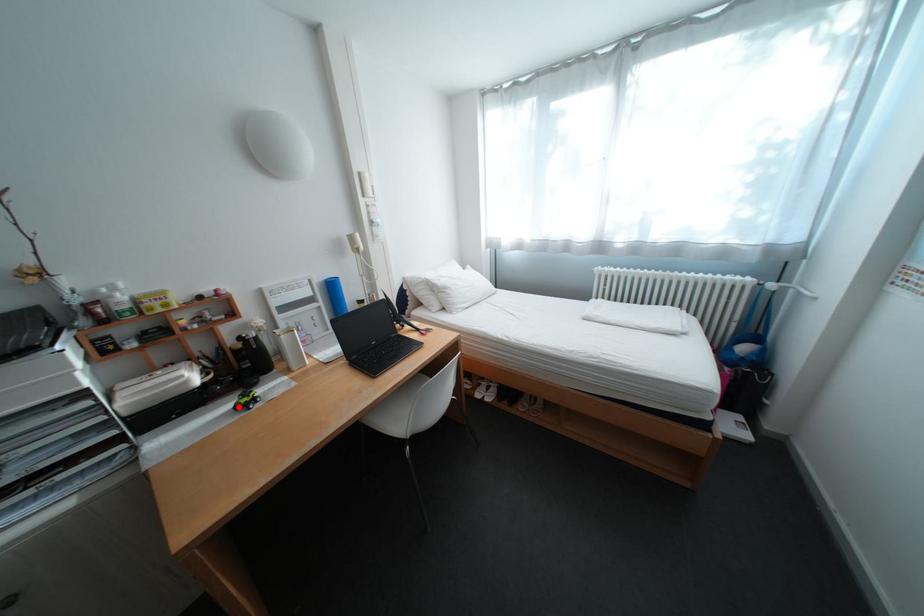
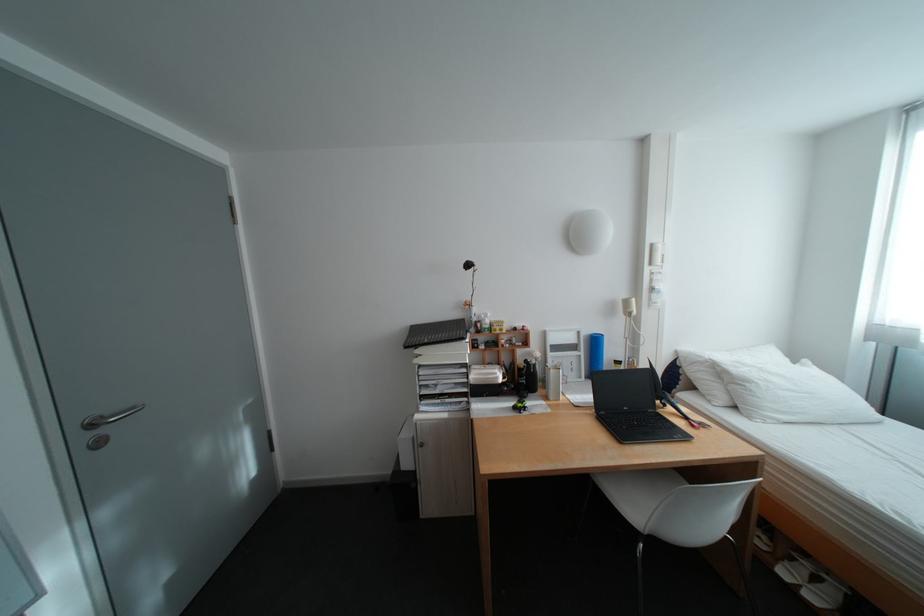
In the second image, find the point that corresponds to the highlighted location in the first image.

(523, 403)